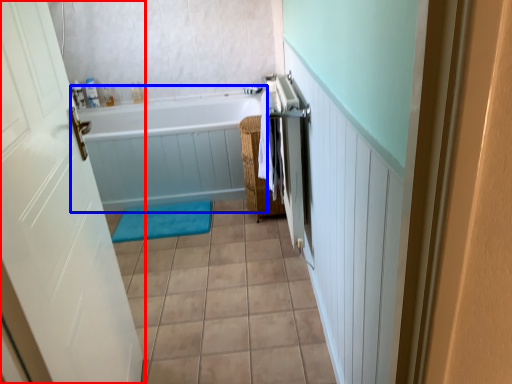
Question: Which point is closer to the camera, door (highlighted by a red box) or bathtub (highlighted by a blue box)?

Choices:
 (A) door
 (B) bathtub

Answer: (A)